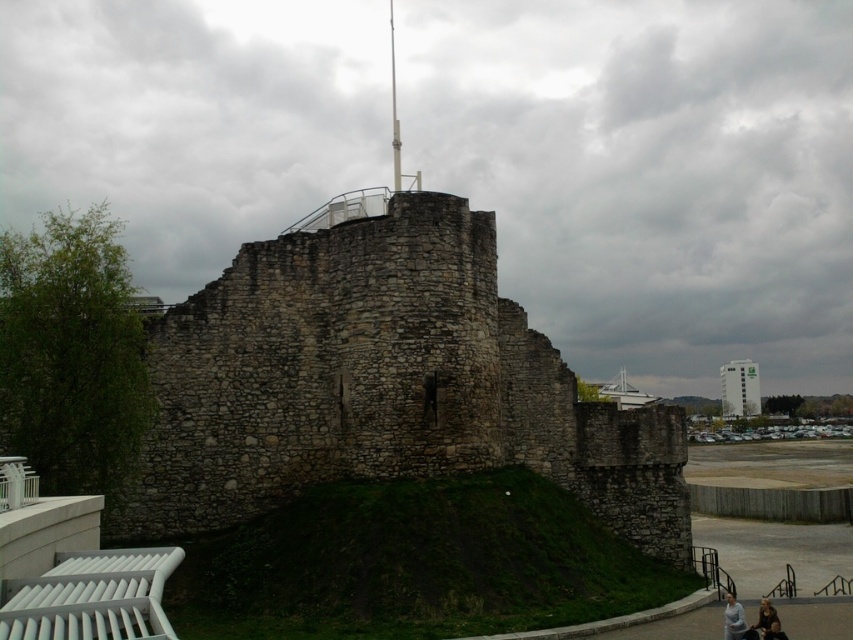
Does golden hair at lower right have a lesser height compared to brown leather jacket at lower right?

Incorrect, golden hair at lower right's height does not fall short of brown leather jacket at lower right's.

Between point (761, 598) and point (773, 628), which one is positioned behind?

Positioned behind is point (761, 598).

The width and height of the screenshot is (853, 640). In order to click on golden hair at lower right in this screenshot , I will do `click(764, 618)`.

Image resolution: width=853 pixels, height=640 pixels. Identify the location of golden hair at lower right. (764, 618).

Which of these two, light blue shirt at lower right or brown leather jacket at lower right, stands taller?

light blue shirt at lower right is taller.

The image size is (853, 640). I want to click on light blue shirt at lower right, so click(x=733, y=618).

Image resolution: width=853 pixels, height=640 pixels. I want to click on light blue shirt at lower right, so click(x=733, y=618).

Between point (737, 605) and point (759, 634), which one is positioned in front?

Point (759, 634) is more forward.

Does point (729, 625) come in front of point (758, 616)?

That is True.

Which is in front, point (727, 621) or point (763, 605)?

Point (727, 621) is more forward.

You are a GUI agent. You are given a task and a screenshot of the screen. Output one action in this format:
    pyautogui.click(x=<x>, y=<y>)
    Task: Click on the light blue shirt at lower right
    
    Given the screenshot: What is the action you would take?
    pyautogui.click(x=733, y=618)